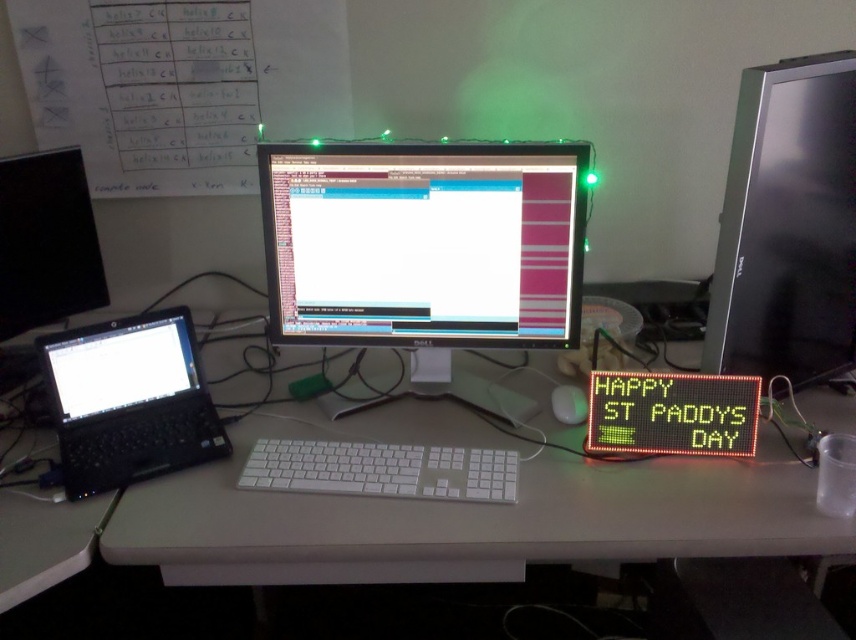
You are setting up a new monitor stand and need to know the positions of the black plastic laptop at left and the black plastic mouse at center. Which object is positioned to the left of the other?

The black plastic laptop at left is positioned to the left of the black plastic mouse at center.

In the scene shown: You are a photographer trying to capture a closeup of the digital signboard on the far right. You notice two points marked on the signboard at coordinates point (685,534) and point (296,465). Which point should you focus on to ensure it appears larger in your photo?

Point (685,534) is closer to the camera than point (296,465), so focusing on point (685,534) will make it appear larger in the photo.

You are setting up a new desk arrangement and want to place a plant between the white plastic monitor at center and the black plastic laptop at left. Based on their positions, where should the plant be placed relative to the monitor?

The white plastic monitor at center is positioned under the black plastic laptop at left, so the plant should be placed between them horizontally, to the right of the black plastic laptop at left and to the left of the white plastic monitor at center.